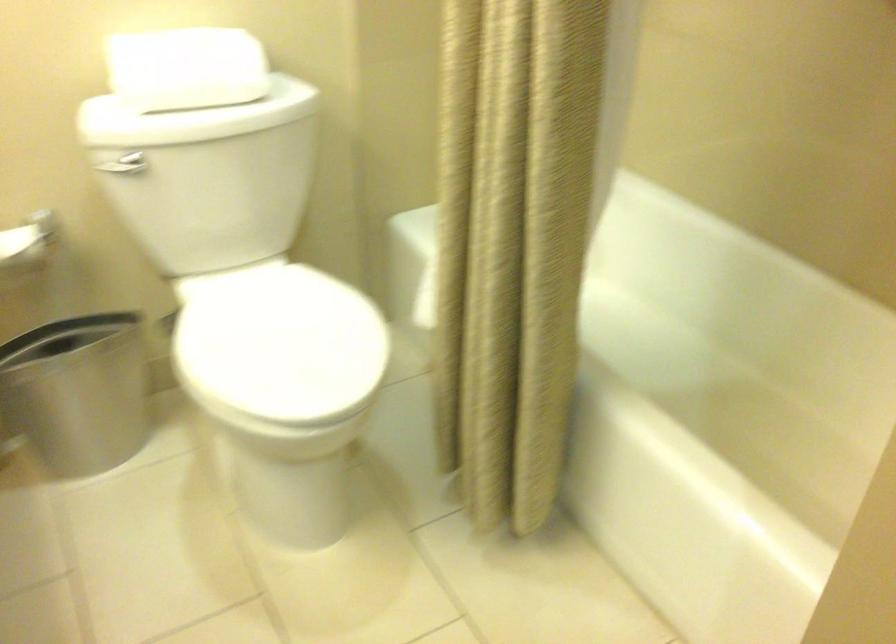
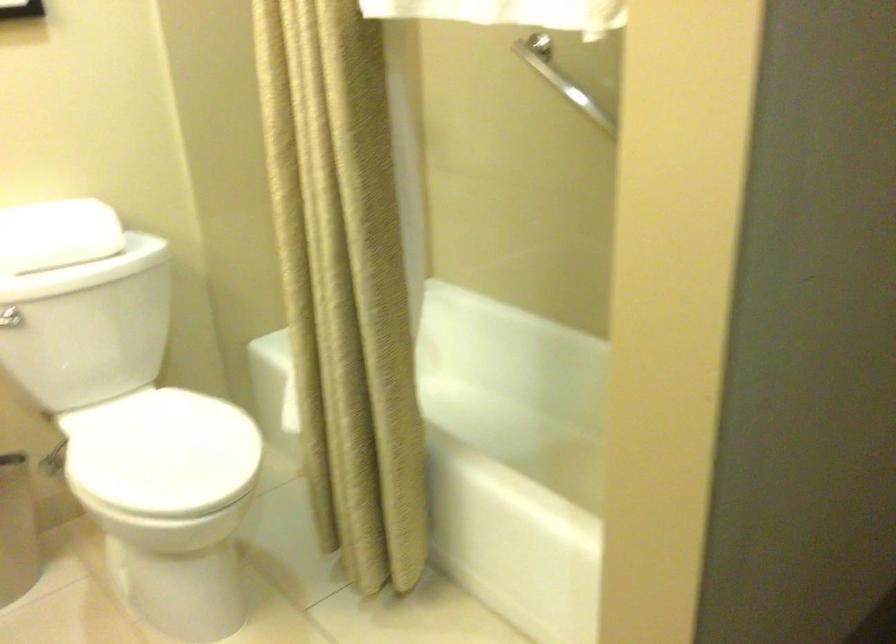
Find the pixel in the second image that matches the point at 277,341 in the first image.

(161, 453)